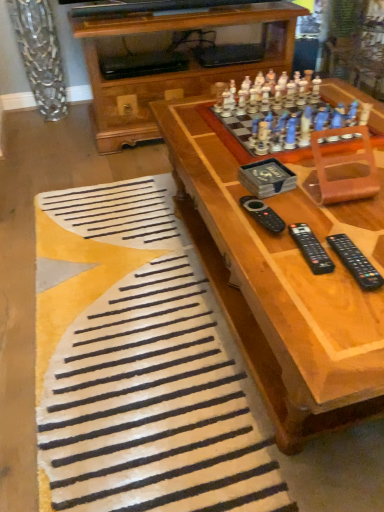
This screenshot has height=512, width=384. Identify the location of vacant space in front of black plastic remote at lower right, acting as the 2th remote starting from the right. (319, 302).